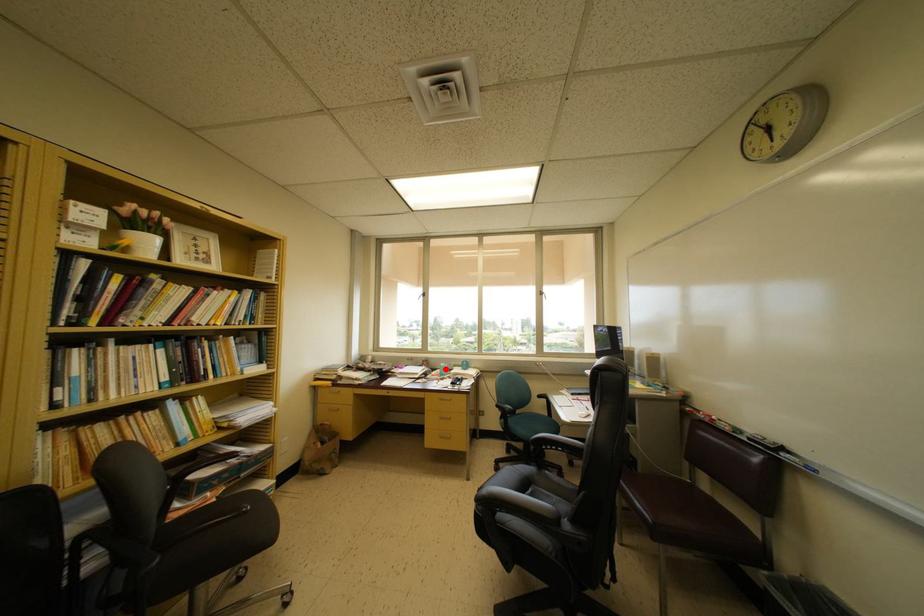
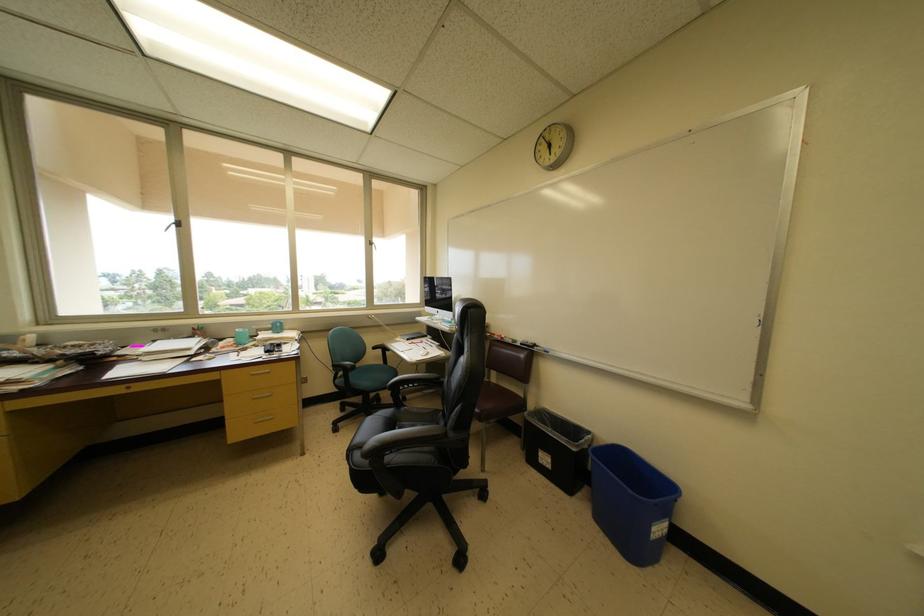
Find the pixel in the second image that matches the highlighted location in the first image.

(240, 334)